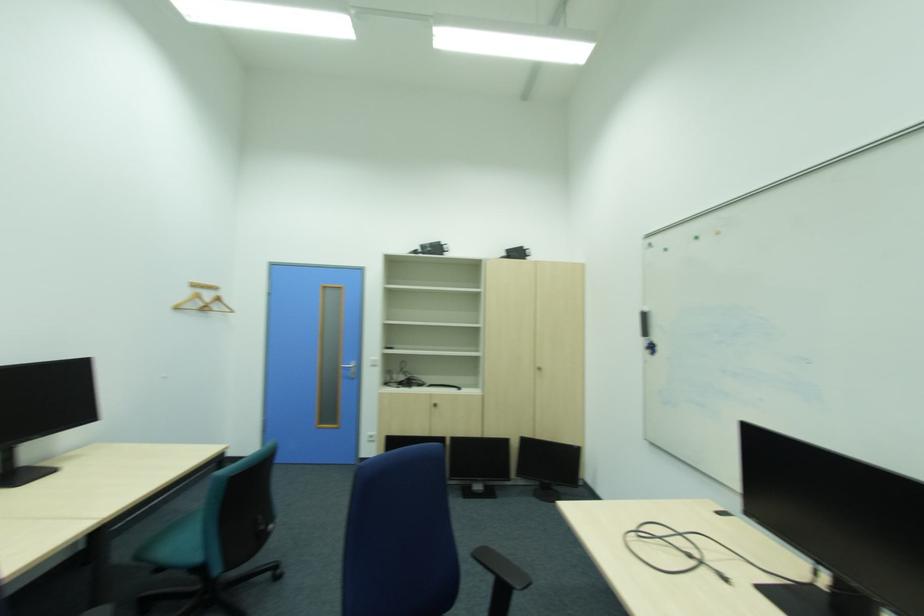
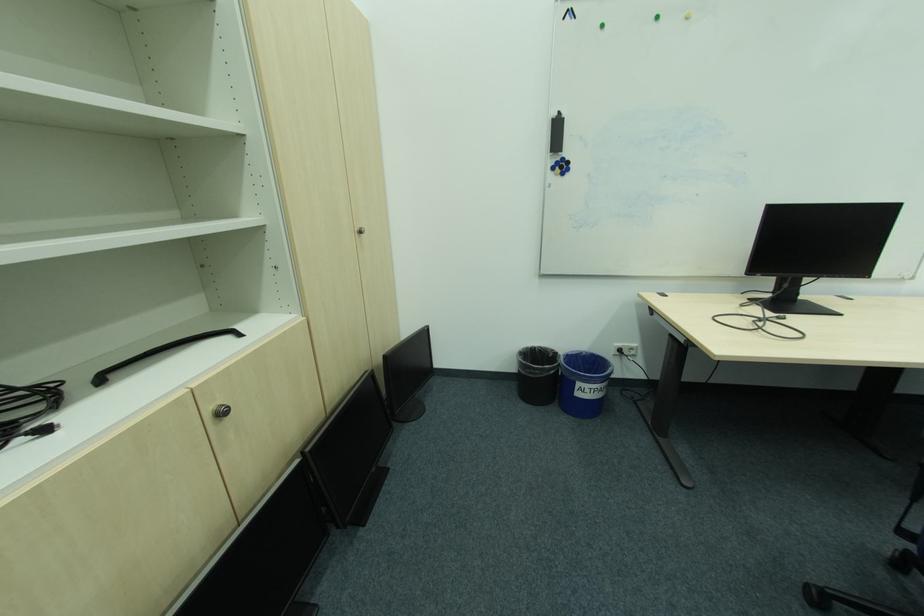
Find the pixel in the second image that matches (x=442, y=406) in the first image.

(227, 415)